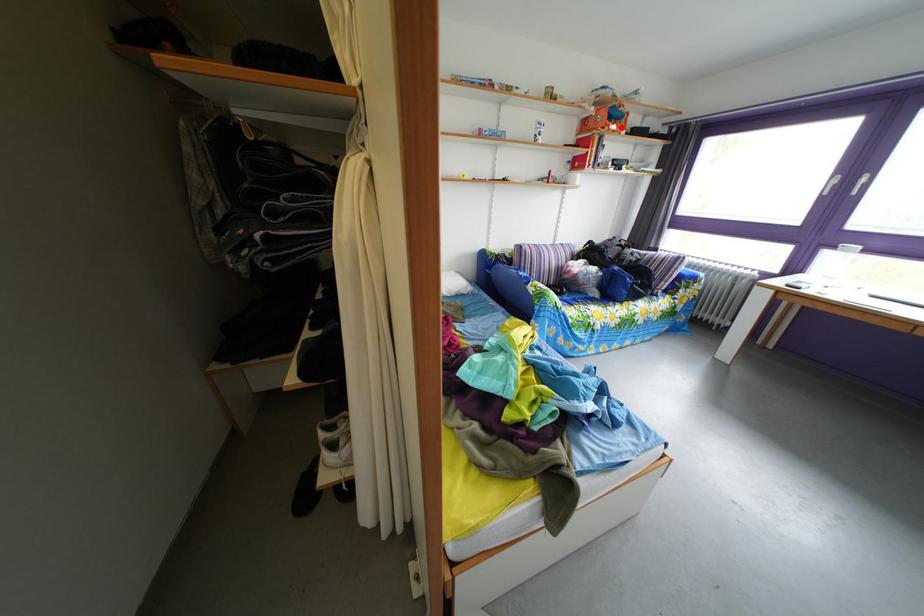
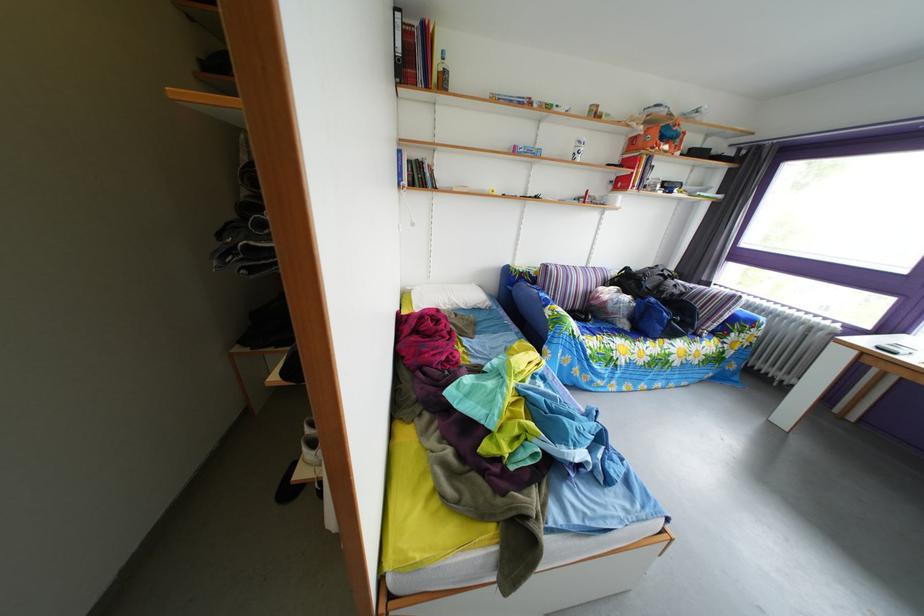
The point at the highlighted location is marked in the first image. Where is the corresponding point in the second image?

(673, 147)